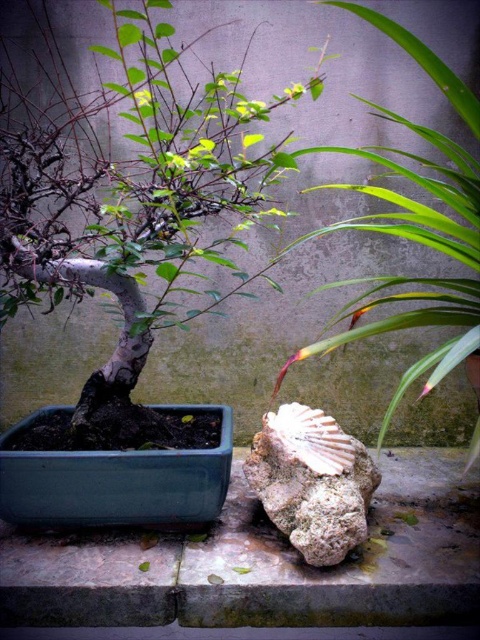
Is green leafy plant at center bigger than rough textured stone at center?

Yes.

Is green leafy plant at center closer to the viewer compared to rough textured stone at center?

Yes, green leafy plant at center is in front of rough textured stone at center.

Locate an element on the screen. The height and width of the screenshot is (640, 480). green leafy plant at center is located at coordinates (416, 200).

Locate an element on the screen. green leafy plant at center is located at coordinates (416, 200).

Which is above, matte gray bonsai at left or green leafy plant at center?

matte gray bonsai at left

Does matte gray bonsai at left have a lesser height compared to green leafy plant at center?

In fact, matte gray bonsai at left may be taller than green leafy plant at center.

Which is behind, point (26, 147) or point (304, 356)?

The point (304, 356) is behind.

At what (x,y) coordinates should I click in order to perform the action: click on matte gray bonsai at left. Please return your answer as a coordinate pair (x, y). This screenshot has height=640, width=480. Looking at the image, I should click on (126, 182).

Does matte gray bonsai at left have a lesser height compared to rough textured stone at center?

Incorrect, matte gray bonsai at left's height does not fall short of rough textured stone at center's.

Based on the photo, who is more distant from viewer, (242, 122) or (289, 442)?

Positioned behind is point (289, 442).

Is point (194, 173) in front of point (342, 509)?

No, (194, 173) is further to viewer.

Identify the location of matte gray bonsai at left. This screenshot has height=640, width=480. (126, 182).